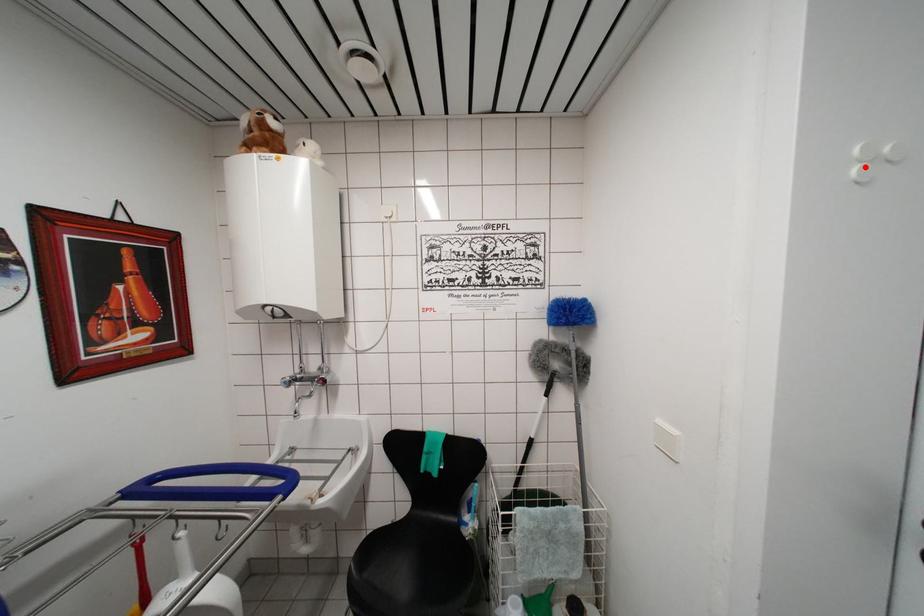
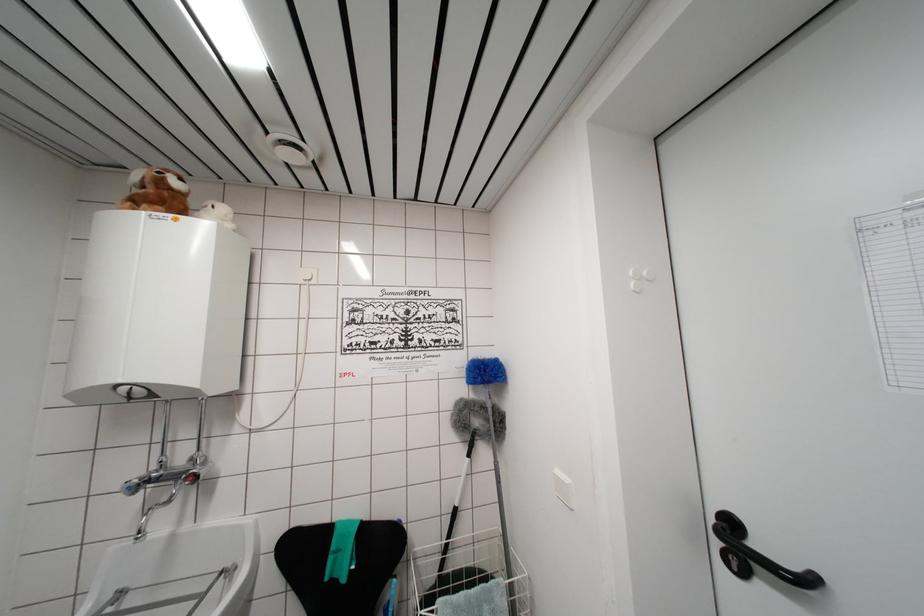
Find the pixel in the second image that matches the highlighted location in the first image.

(638, 285)